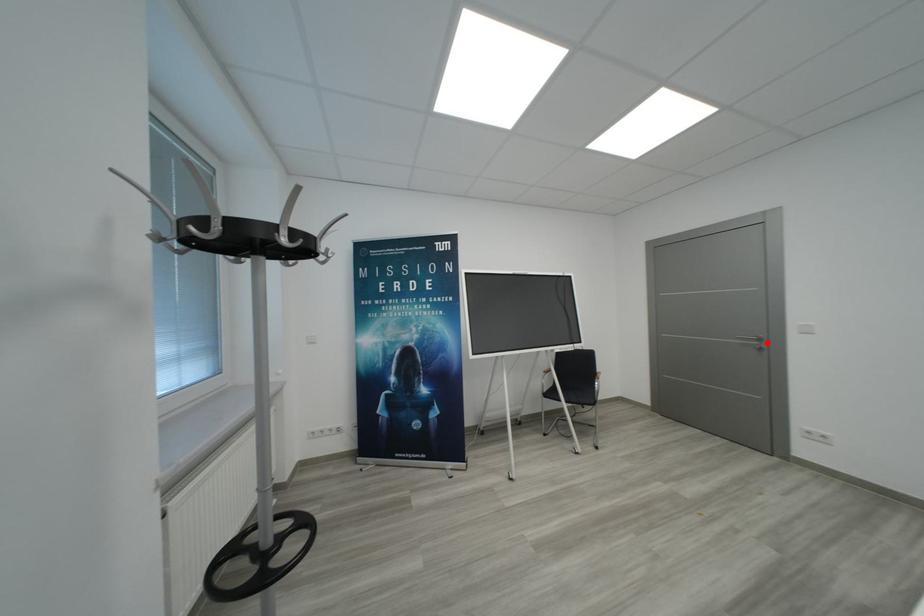
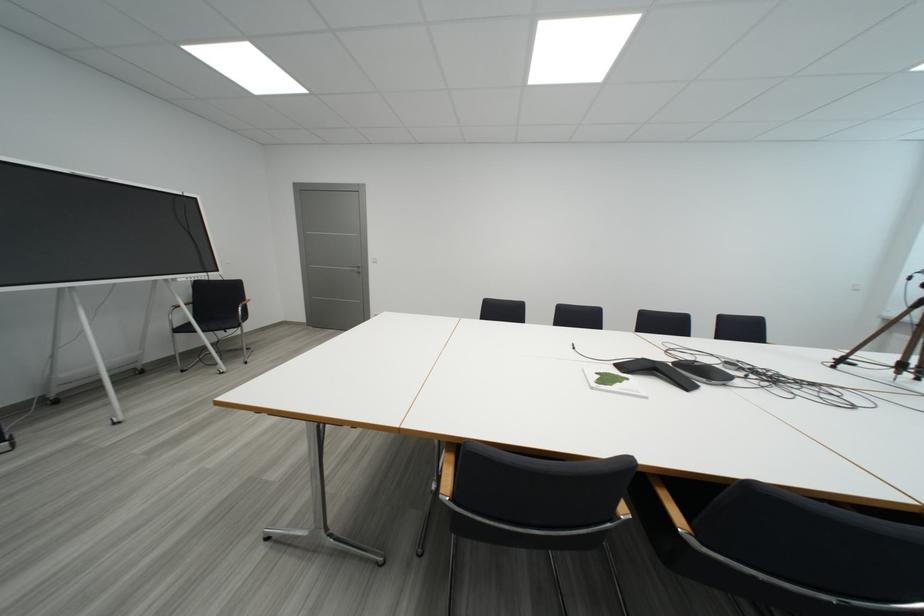
The point at the highlighted location is marked in the first image. Where is the corresponding point in the second image?

(366, 270)